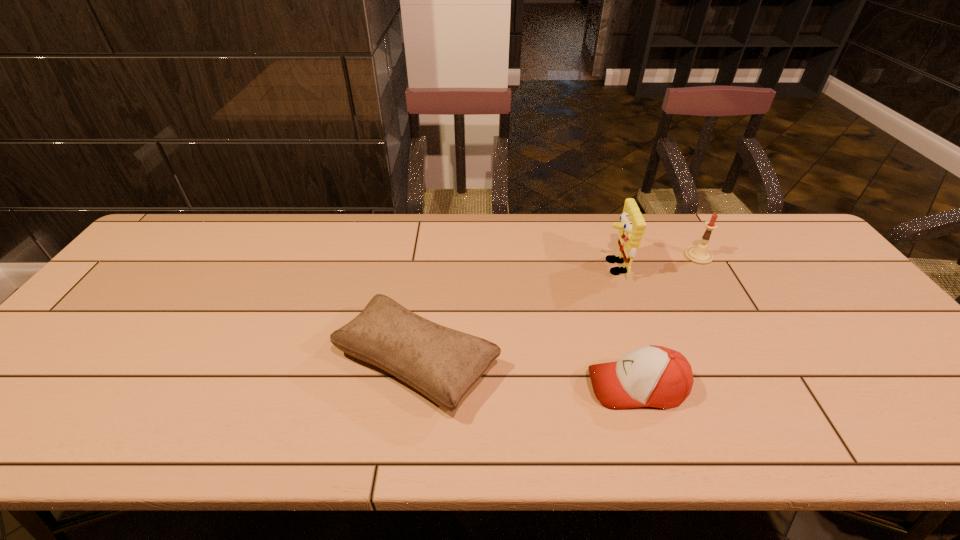
This screenshot has height=540, width=960. What are the coordinates of `sponge` in the screenshot? It's located at (631, 229).

At what (x,y) coordinates should I click in order to perform the action: click on the third shortest object. Please return your answer as a coordinate pair (x, y). Image resolution: width=960 pixels, height=540 pixels. Looking at the image, I should click on (699, 254).

Where is `the rightmost object`? the rightmost object is located at coordinates (699, 254).

This screenshot has height=540, width=960. In order to click on the leftmost object in this screenshot , I will do `click(443, 364)`.

Find the location of a particular element. baseball cap is located at coordinates (652, 376).

You are a GUI agent. You are given a task and a screenshot of the screen. Output one action in this format:
    pyautogui.click(x=<x>, y=<y>)
    Task: Click on the vacant space situated 0.360m on the face of the sponge
    The width and height of the screenshot is (960, 540).
    Given the screenshot: What is the action you would take?
    pyautogui.click(x=481, y=267)

Find the location of `vacant area situated 0.300m on the face of the sponge`. vacant area situated 0.300m on the face of the sponge is located at coordinates (501, 267).

Identify the location of free region located on the face of the sponge. (468, 267).

Find the location of a particular element. This screenshot has width=960, height=540. vacant area located on the right of the rightmost object is located at coordinates (797, 256).

The image size is (960, 540). In order to click on free space located 0.190m on the right of the cushion in this screenshot , I will do coord(580,363).